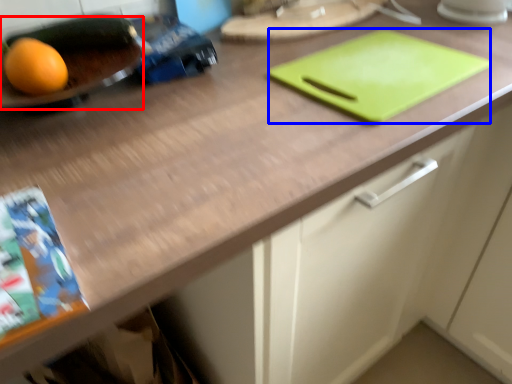
Question: Which point is further to the camera, tray (highlighted by a red box) or tray (highlighted by a blue box)?

Choices:
 (A) tray
 (B) tray

Answer: (B)